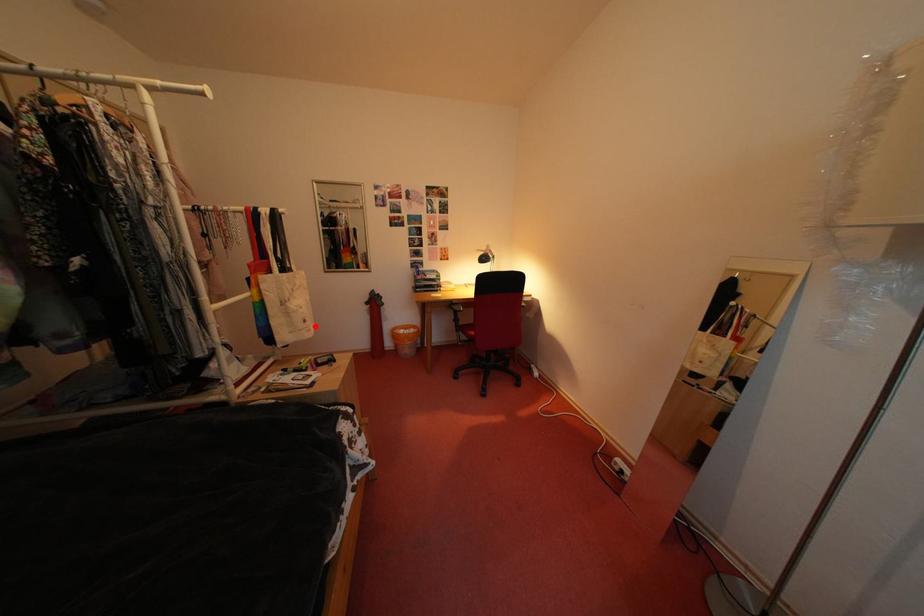
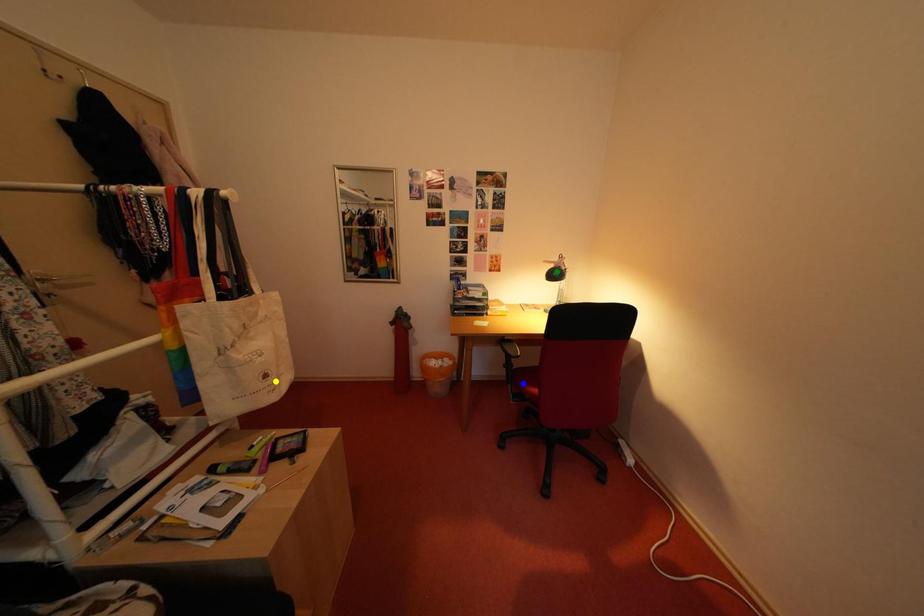
Question: I am providing you with two images of the same scene from different viewpoints. A red point is marked on the first image. You are given multiple points on the second image. Which point in image 2 is actually the same real-world point as the red point in image 1?

Choices:
 (A) blue point
 (B) green point
 (C) yellow point

Answer: (C)